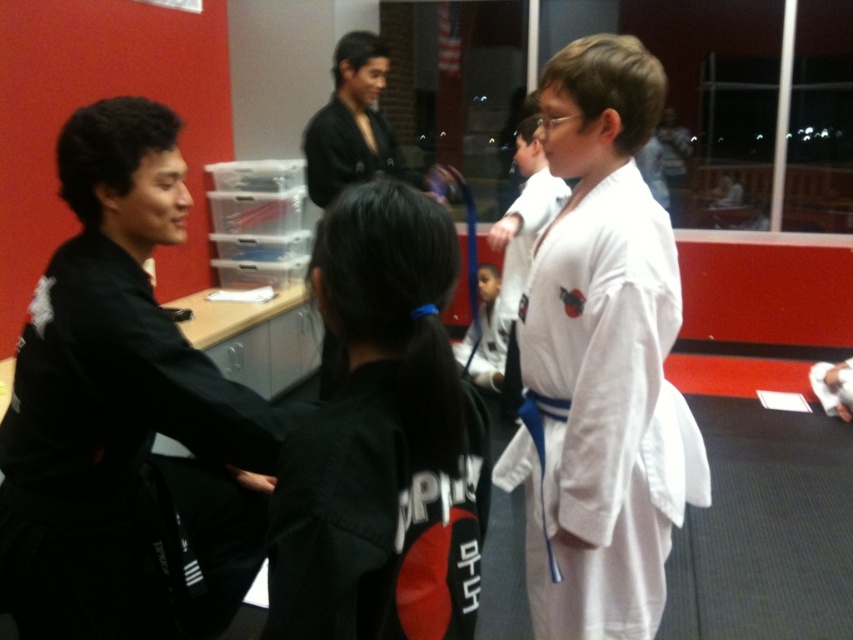
The image size is (853, 640). What do you see at coordinates (125, 464) in the screenshot?
I see `black matte uniform at left` at bounding box center [125, 464].

Which is more to the left, black matte uniform at left or black matte robe at upper center?

black matte uniform at left is more to the left.

Between point (68, 557) and point (341, 161), which one is positioned in front?

Point (68, 557) is in front.

You are a GUI agent. You are given a task and a screenshot of the screen. Output one action in this format:
    pyautogui.click(x=<x>, y=<y>)
    Task: Click on the black matte uniform at left
    This screenshot has height=640, width=853.
    Given the screenshot: What is the action you would take?
    pyautogui.click(x=125, y=464)

Can you confirm if black fabric uniform at center is shorter than white cotton karate gi at center?

Yes.

Does black fabric uniform at center have a greater height compared to white cotton karate gi at center?

In fact, black fabric uniform at center may be shorter than white cotton karate gi at center.

Who is more distant from viewer, (341,525) or (650,452)?

Positioned behind is point (650,452).

What are the coordinates of `black fabric uniform at center` in the screenshot? It's located at (381, 442).

Which is behind, point (581, 419) or point (306, 134)?

Positioned behind is point (306, 134).

At what (x,y) coordinates should I click in order to perform the action: click on white cotton karate gi at center. Please return your answer as a coordinate pair (x, y). Looking at the image, I should click on (602, 417).

Which is behind, point (582, 548) or point (390, 129)?

Point (390, 129)

Find the location of `white cotton karate gi at center`. white cotton karate gi at center is located at coordinates (602, 417).